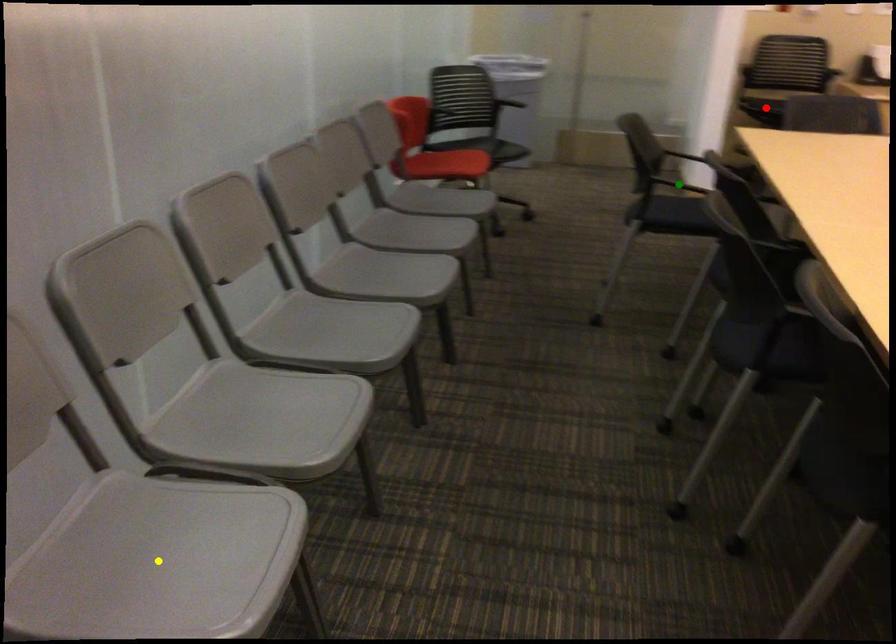
Order these from nearest to farthest:
red point
green point
yellow point

yellow point
green point
red point